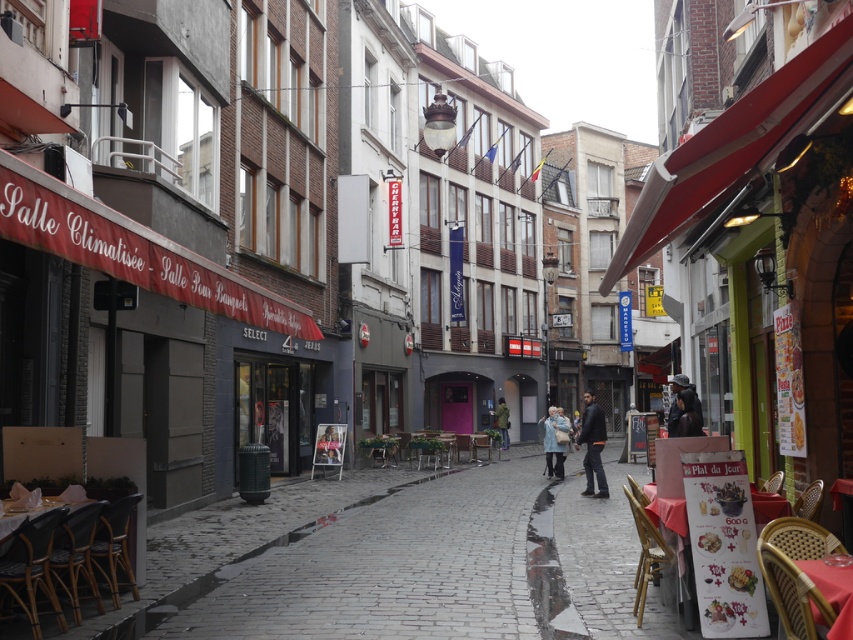
You are standing on a narrow cobblestone street in an urban European setting. You see a dark gray jacket at center. Where exactly is the dark gray jacket located in terms of coordinates?

The dark gray jacket at center is located at coordinates point (592, 444).

You are standing at point (552, 429) and want to walk to point (596, 468). Which direction should you move relative to the street layout?

You should move forward along the street because point (596, 468) is in front of point (552, 429).